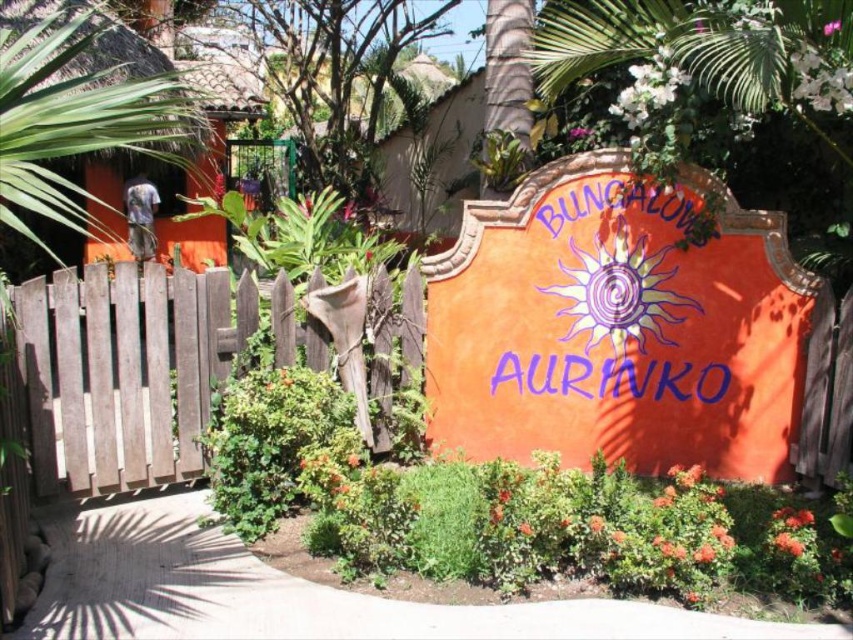
Question: Which of the following is the closest to the observer?

Choices:
 (A) (305, 352)
 (B) (582, 392)

Answer: (A)

Question: Can you confirm if orange stucco sign at center is positioned to the left of weathered wood gate at left?

Choices:
 (A) no
 (B) yes

Answer: (A)

Question: Among these objects, which one is nearest to the camera?

Choices:
 (A) weathered wood gate at left
 (B) pink matte flower at center
 (C) purple painted sign at center
 (D) orange stucco sign at center

Answer: (B)

Question: In this image, where is orange stucco sign at center located relative to pink matte flower at center?

Choices:
 (A) above
 (B) below

Answer: (B)

Question: Does orange stucco sign at center come in front of weathered wood gate at left?

Choices:
 (A) no
 (B) yes

Answer: (A)

Question: Estimate the real-world distances between objects in this image. Which object is farther from the orange stucco sign at center?

Choices:
 (A) pink matte flower at center
 (B) purple painted sign at center

Answer: (A)